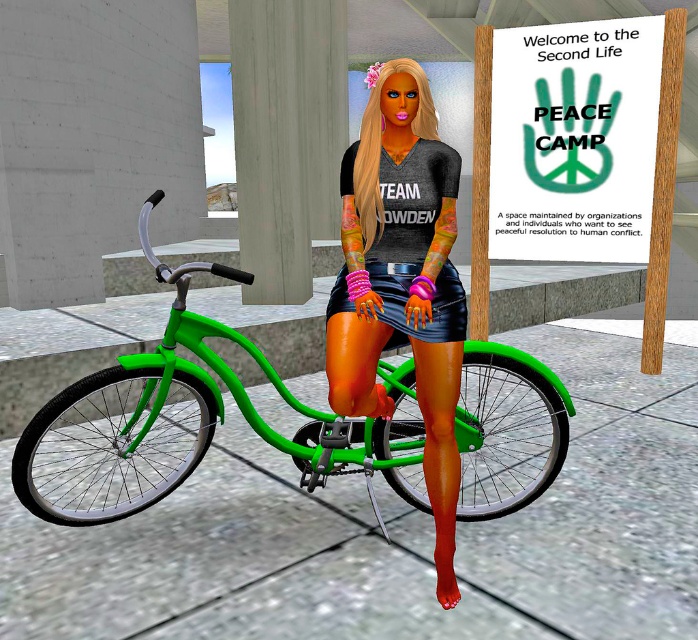
You are a fashion designer analyzing the outfit of the character in the scene. Which item is positioned lower on the body between the matte black shirt at center and the shiny leather skirt at center?

The matte black shirt at center is located below the shiny leather skirt at center, so it is positioned lower on the body.

You are a fashion designer observing the character in the scene. You notice the matte black shirt at center and the shiny leather skirt at center. Which clothing item takes up more visual space in the image?

The matte black shirt at center is larger in size than the shiny leather skirt at center, so the matte black shirt at center takes up more visual space in the image.